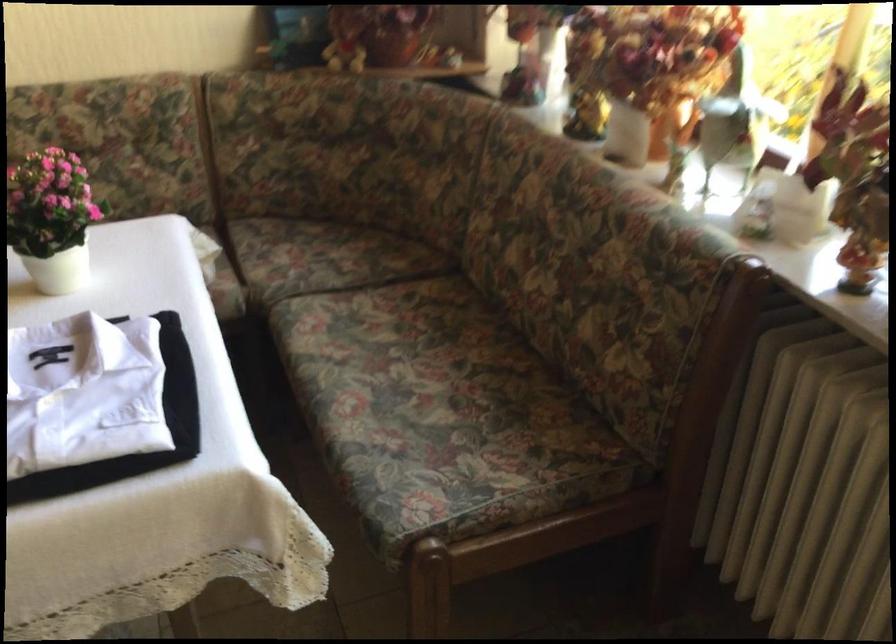
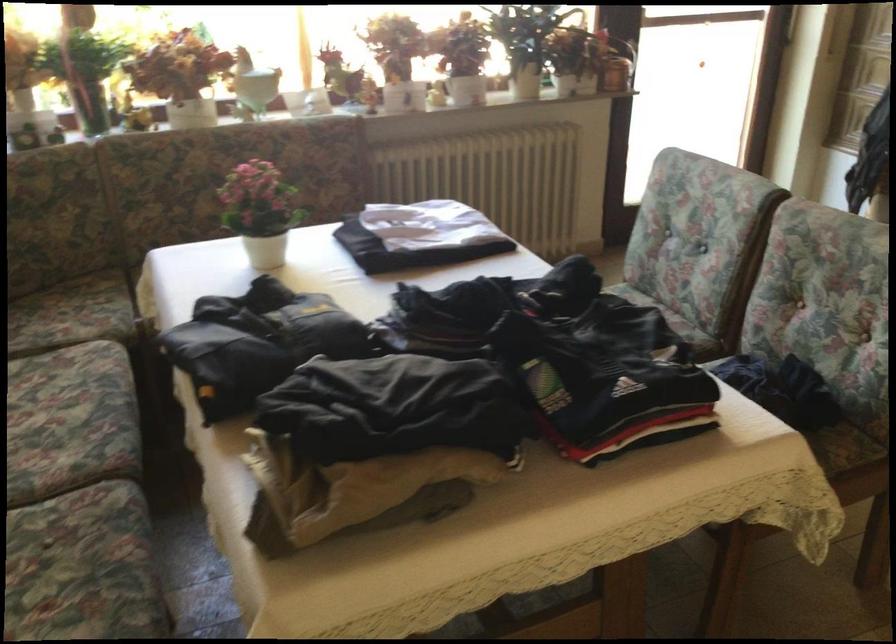
Where in the second image is the point corresponding to (x=688, y=126) from the first image?

(252, 84)